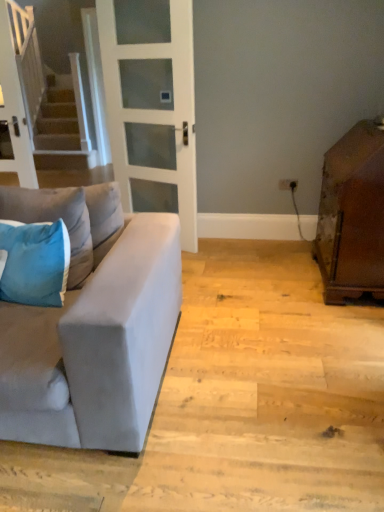
Question: Is suede gray couch at left thinner than blue fabric pillow at left, the first pillow in the bottom-to-top sequence?

Choices:
 (A) yes
 (B) no

Answer: (B)

Question: Is suede gray couch at left further to camera compared to blue fabric pillow at left, placed as the 2th pillow when sorted from top to bottom?

Choices:
 (A) no
 (B) yes

Answer: (A)

Question: Is suede gray couch at left facing towards blue fabric pillow at left, placed as the 2th pillow when sorted from top to bottom?

Choices:
 (A) yes
 (B) no

Answer: (A)

Question: From the image's perspective, would you say suede gray couch at left is shown under blue fabric pillow at left, the first pillow in the bottom-to-top sequence?

Choices:
 (A) yes
 (B) no

Answer: (A)

Question: Is suede gray couch at left outside of blue fabric pillow at left, placed as the 2th pillow when sorted from top to bottom?

Choices:
 (A) yes
 (B) no

Answer: (A)

Question: Does suede gray couch at left have a smaller size compared to blue fabric pillow at left, placed as the 2th pillow when sorted from top to bottom?

Choices:
 (A) yes
 (B) no

Answer: (B)

Question: Does white frosted glass door at center have a lesser height compared to suede gray couch at left?

Choices:
 (A) yes
 (B) no

Answer: (B)

Question: Does white frosted glass door at center have a larger size compared to suede gray couch at left?

Choices:
 (A) no
 (B) yes

Answer: (A)

Question: Is suede gray couch at left at the back of white frosted glass door at center?

Choices:
 (A) no
 (B) yes

Answer: (A)

Question: Would you say white frosted glass door at center contains suede gray couch at left?

Choices:
 (A) no
 (B) yes

Answer: (A)

Question: Is the position of white frosted glass door at center more distant than that of suede gray couch at left?

Choices:
 (A) no
 (B) yes

Answer: (B)

Question: From a real-world perspective, is white frosted glass door at center physically above suede gray couch at left?

Choices:
 (A) yes
 (B) no

Answer: (A)

Question: Can you confirm if blue velvet pillow at left, arranged as the 1th pillow when viewed from the top, is wider than brown wooden cabinet at right?

Choices:
 (A) no
 (B) yes

Answer: (A)